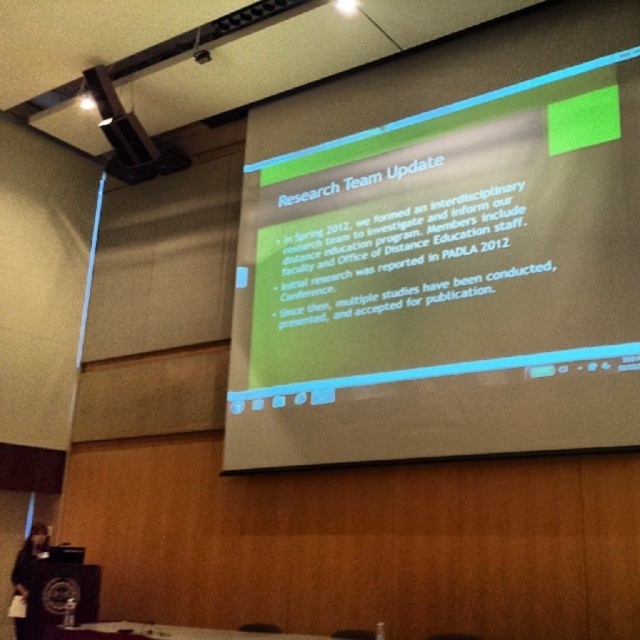
Based on the photo, who is positioned more to the left, green matte projector screen at upper center or black fabric at lower left?

Positioned to the left is black fabric at lower left.

Does green matte projector screen at upper center have a smaller size compared to black fabric at lower left?

No, green matte projector screen at upper center is not smaller than black fabric at lower left.

Which is behind, point (566, 253) or point (19, 589)?

Point (19, 589)

You are a GUI agent. You are given a task and a screenshot of the screen. Output one action in this format:
    pyautogui.click(x=<x>, y=<y>)
    Task: Click on the green matte projector screen at upper center
    The image size is (640, 640).
    Given the screenshot: What is the action you would take?
    pyautogui.click(x=440, y=266)

Describe the element at coordinates (161, 632) in the screenshot. The width and height of the screenshot is (640, 640). I see `white glossy table at lower center` at that location.

Which is more to the right, white glossy table at lower center or black fabric at lower left?

white glossy table at lower center is more to the right.

Locate an element on the screen. white glossy table at lower center is located at coordinates (161, 632).

Is green matte projector screen at upper center positioned at the back of white glossy table at lower center?

That is False.

Between green matte projector screen at upper center and white glossy table at lower center, which one has more height?

green matte projector screen at upper center is taller.

At what (x,y) coordinates should I click in order to perform the action: click on green matte projector screen at upper center. Please return your answer as a coordinate pair (x, y). This screenshot has height=640, width=640. Looking at the image, I should click on (440, 266).

Where is `green matte projector screen at upper center`? This screenshot has width=640, height=640. green matte projector screen at upper center is located at coordinates (440, 266).